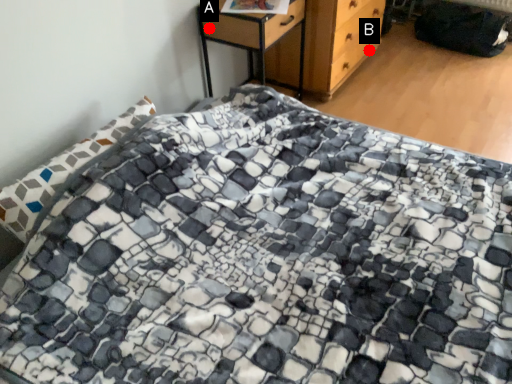
Question: Two points are circled on the image, labeled by A and B beside each circle. Which point appears closest to the camera in this image?

Choices:
 (A) A is closer
 (B) B is closer

Answer: (A)